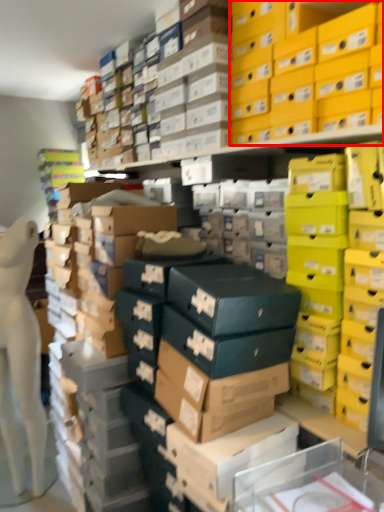
Question: Considering the relative positions of storage box (annotated by the red box) and cardboard box in the image provided, where is storage box (annotated by the red box) located with respect to the staircase?

Choices:
 (A) right
 (B) left

Answer: (A)